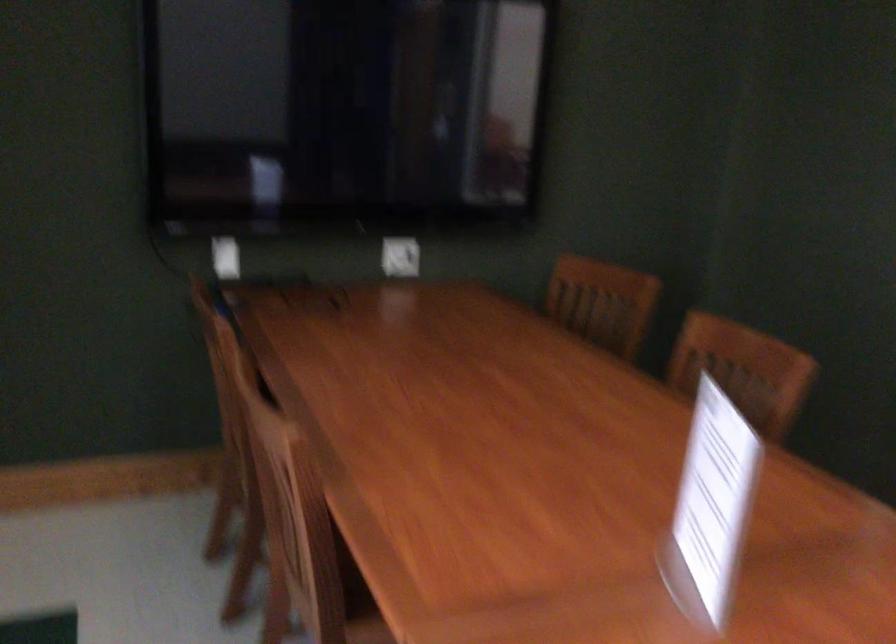
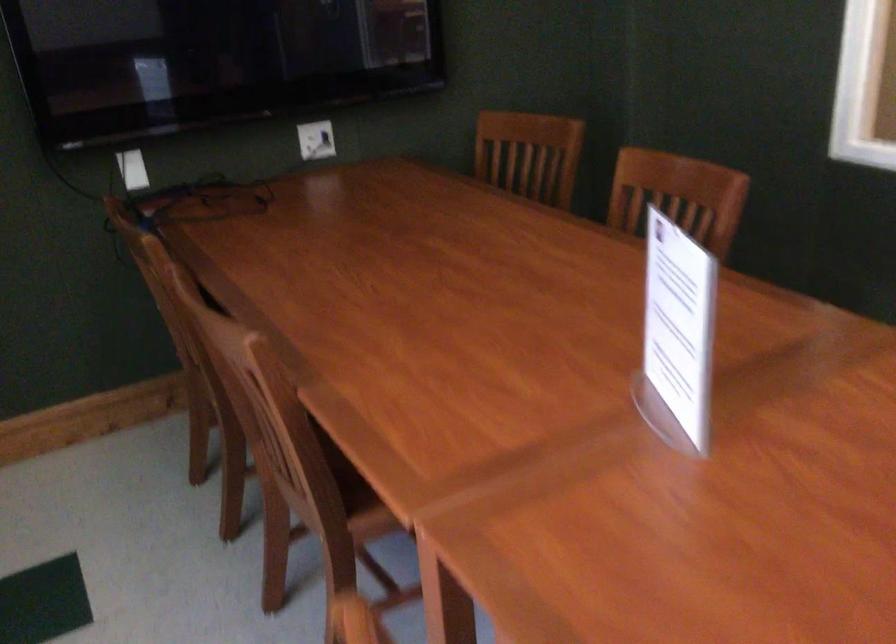
Locate, in the second image, the point that corresponds to point 743,366 in the first image.

(677, 196)